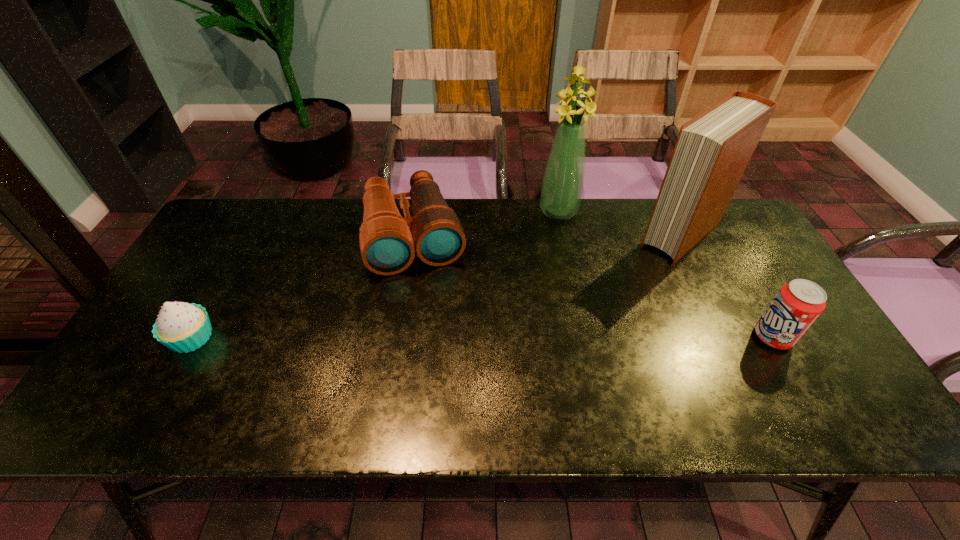
You are a GUI agent. You are given a task and a screenshot of the screen. Output one action in this format:
    pyautogui.click(x=<x>, y=<y>)
    Task: Click on the blank space at the far right corner of the desktop
    This screenshot has width=960, height=540.
    Given the screenshot: What is the action you would take?
    pyautogui.click(x=736, y=242)

Identify the location of vacant space at the near right corner of the desktop. This screenshot has width=960, height=540. pyautogui.click(x=811, y=374).

The image size is (960, 540). What are the coordinates of `vacant region between the soda can and the binoculars` in the screenshot? It's located at (593, 286).

Image resolution: width=960 pixels, height=540 pixels. Identify the location of free space between the bouquet and the fourth shortest object. (620, 224).

You are a GUI agent. You are given a task and a screenshot of the screen. Output one action in this format:
    pyautogui.click(x=<x>, y=<y>)
    Task: Click on the blank region between the bouquet and the soda can
    
    Given the screenshot: What is the action you would take?
    pyautogui.click(x=665, y=274)

I want to click on empty space between the binoculars and the bouquet, so click(487, 224).

I want to click on vacant area between the third object from right to left and the cupcake, so click(375, 275).

What are the coordinates of `vacant space in between the second tallest object and the soda can` in the screenshot? It's located at 727,286.

Locate an element on the screen. This screenshot has height=540, width=960. empty location between the hardback book and the soda can is located at coordinates (727, 286).

You are a GUI agent. You are given a task and a screenshot of the screen. Output one action in this format:
    pyautogui.click(x=<x>, y=<y>)
    Task: Click on the free spot between the third object from right to left and the leftmost object
    Image resolution: width=960 pixels, height=540 pixels.
    Given the screenshot: What is the action you would take?
    pyautogui.click(x=375, y=275)